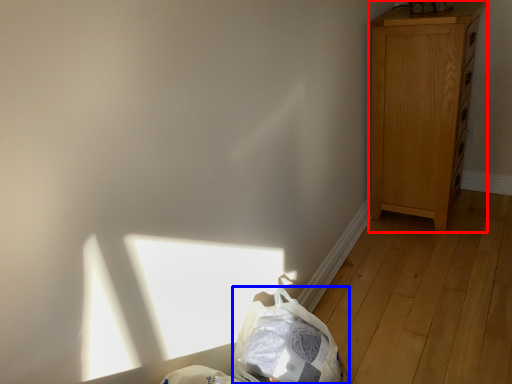
Question: Which of the following is the farthest to the observer, dresser (highlighted by a red box) or diaper bag (highlighted by a blue box)?

Choices:
 (A) dresser
 (B) diaper bag

Answer: (A)